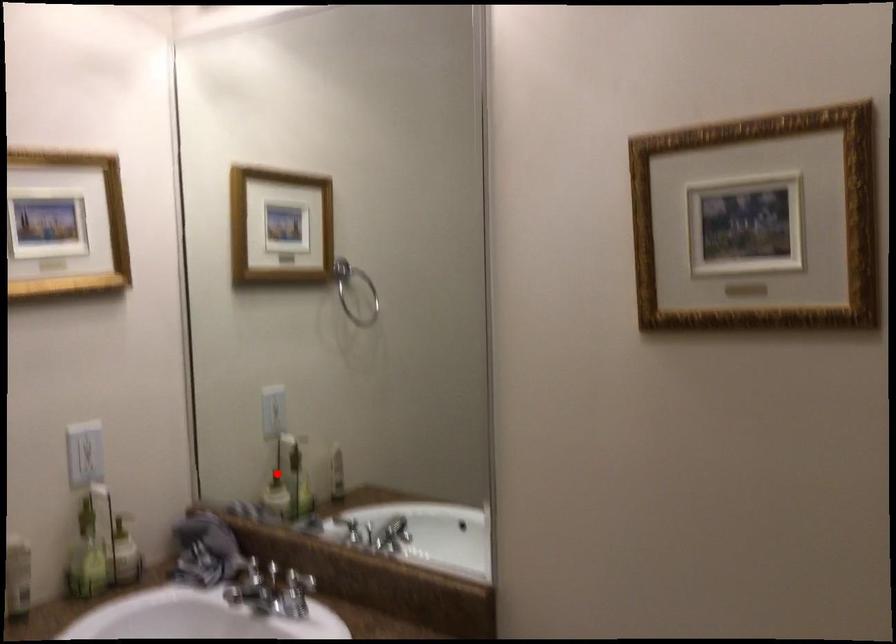
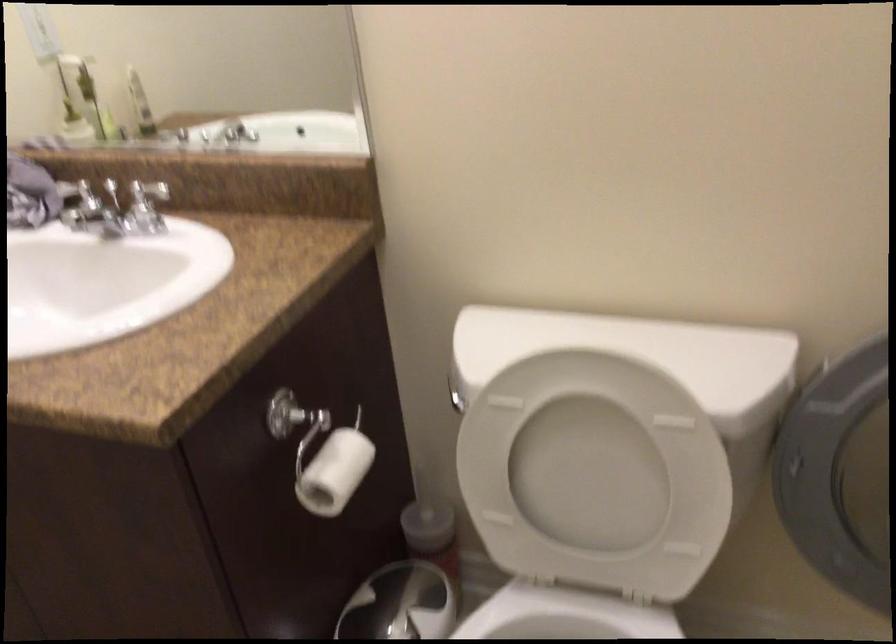
Question: I am providing you with two images of the same scene from different viewpoints. In image1, a red point is highlighted. Considering the same 3D point in image2, which of the following is correct?

Choices:
 (A) It is closer
 (B) It is farther

Answer: (A)